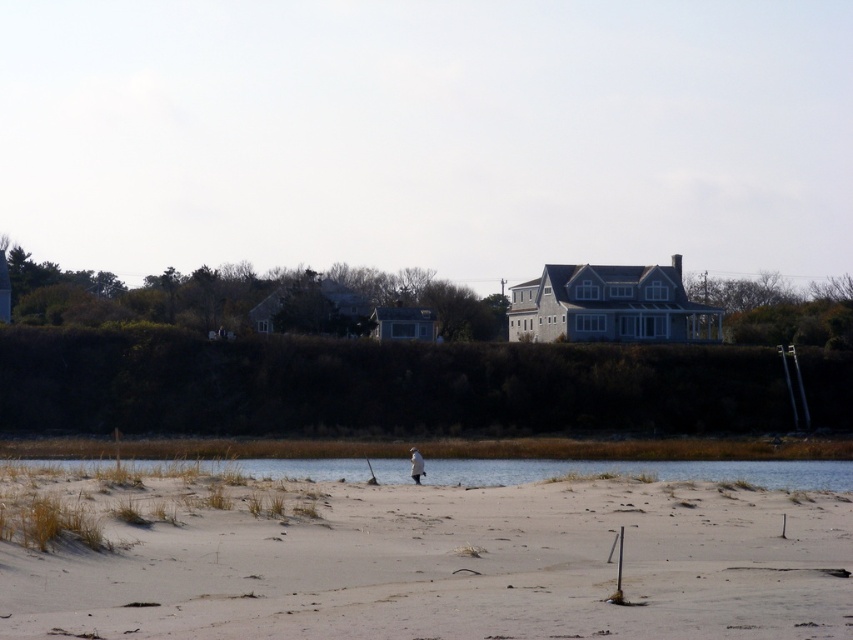
Image resolution: width=853 pixels, height=640 pixels. What are the coordinates of `white sandy beach at lower left` in the screenshot? It's located at (416, 557).

Where is `white sandy beach at lower left`? The image size is (853, 640). white sandy beach at lower left is located at coordinates coord(416,557).